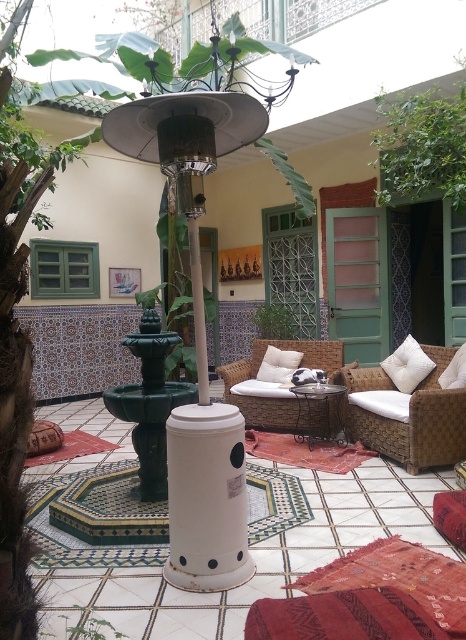
Is point (280, 634) farther from viewer compared to point (226, 372)?

No, it is in front of (226, 372).

How distant is velvet red rug at lower right from white wicker armchair at center?

velvet red rug at lower right is 3.44 meters from white wicker armchair at center.

Measure the distance between point (367, 621) and camera.

The distance of point (367, 621) from camera is 5.73 feet.

Locate an element on the screen. velvet red rug at lower right is located at coordinates tap(342, 616).

Which is in front, point (245, 540) or point (446, 161)?

Positioned in front is point (245, 540).

Does point (179, 420) lie behind point (391, 172)?

That is False.

Identify the location of white matte cylinder at center. The height and width of the screenshot is (640, 466). (206, 497).

Who is taller, white soft cushion at upper right or white soft cushion at center?

Standing taller between the two is white soft cushion at upper right.

Is the position of white soft cushion at upper right more distant than that of white soft cushion at center?

Yes, it is behind white soft cushion at center.

Image resolution: width=466 pixels, height=640 pixels. What do you see at coordinates (408, 365) in the screenshot?
I see `white soft cushion at upper right` at bounding box center [408, 365].

Where is `white soft cushion at upper right`? white soft cushion at upper right is located at coordinates (408, 365).